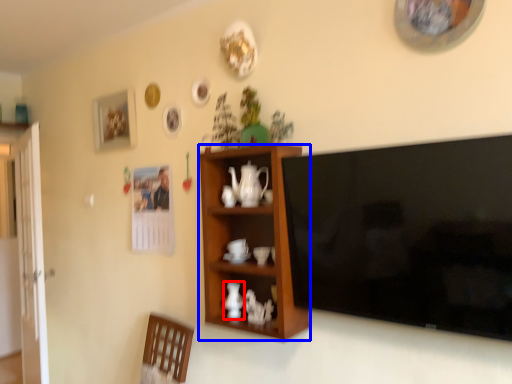
Question: Which object is further to the camera taking this photo, vase (highlighted by a red box) or cabinetry (highlighted by a blue box)?

Choices:
 (A) vase
 (B) cabinetry

Answer: (A)